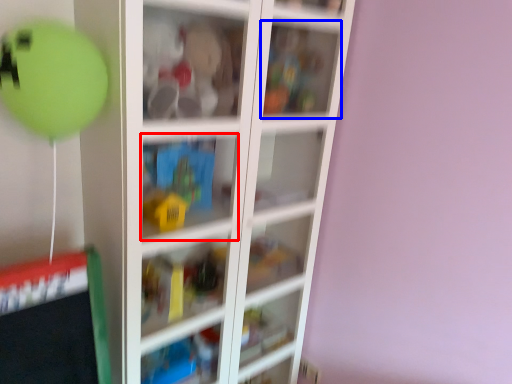
Question: Which object is closer to the camera taking this photo, cabinet (highlighted by a red box) or cabinet (highlighted by a blue box)?

Choices:
 (A) cabinet
 (B) cabinet

Answer: (A)